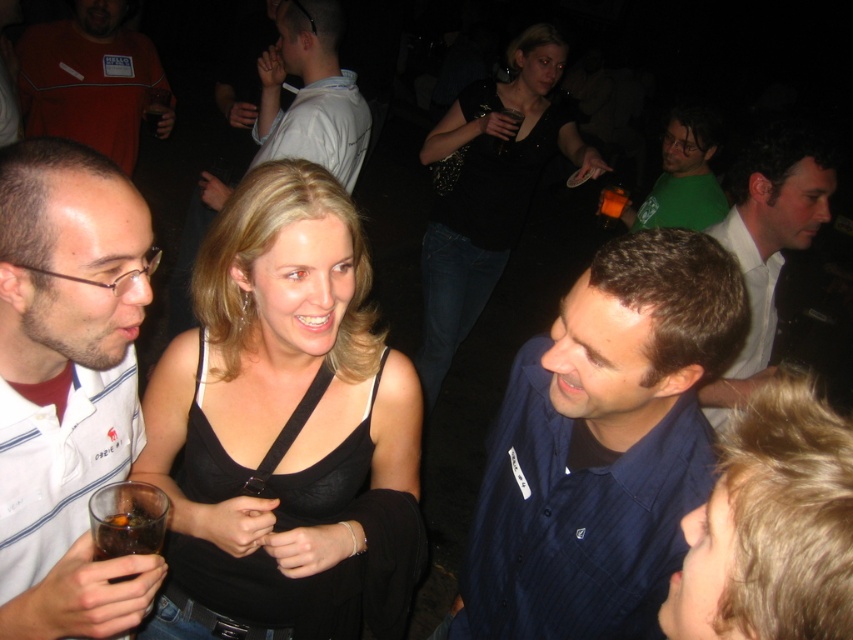
You are at a party and need to decide which item to take with you first. The orange fleece jacket at upper left and the white shirt at upper center are both in your line of sight. Based on their sizes, which one would be easier to grab quickly?

The orange fleece jacket at upper left is larger in size than the white shirt at upper center, so it would be easier to grab quickly.

You are at a party and want to know which person has a wider shirt between the dark blue striped shirt at center and the green matte shirt at upper right. Can you tell me which one?

The dark blue striped shirt at center has a larger width than the green matte shirt at upper right, so the dark blue striped shirt at center is wider.